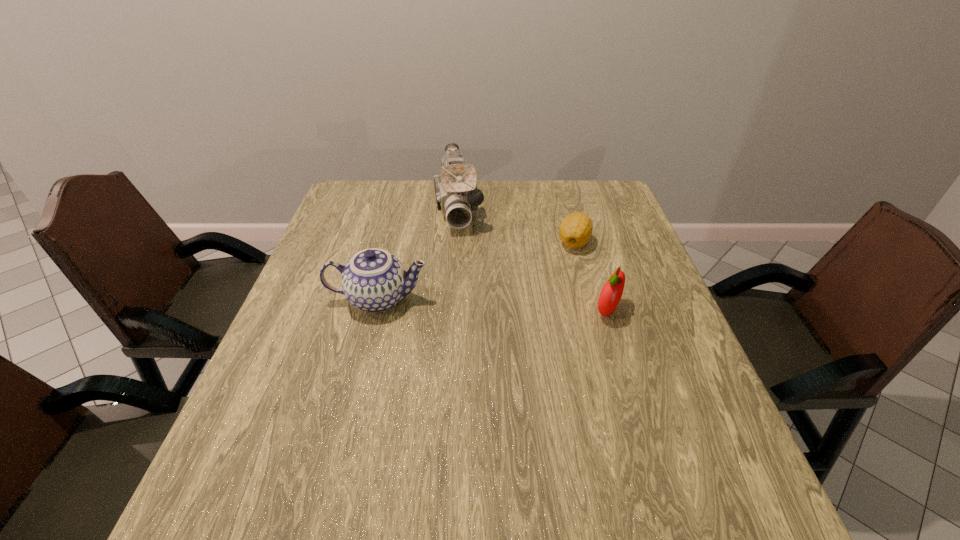
Find the location of `vacant space situated 0.400m at the stem end of the lemon`. vacant space situated 0.400m at the stem end of the lemon is located at coordinates (465, 334).

At what (x,y) coordinates should I click in order to perform the action: click on blank area located at the stem end of the lemon. Please return your answer as a coordinate pair (x, y). Looking at the image, I should click on (552, 262).

You are a GUI agent. You are given a task and a screenshot of the screen. Output one action in this format:
    pyautogui.click(x=<x>, y=<y>)
    Task: Click on the object located at the far edge
    
    Given the screenshot: What is the action you would take?
    pyautogui.click(x=456, y=192)

This screenshot has height=540, width=960. In order to click on object that is positioned at the left edge in this screenshot , I will do `click(374, 280)`.

At what (x,y) coordinates should I click in order to perform the action: click on apple that is at the right edge. Please return your answer as a coordinate pair (x, y). This screenshot has height=540, width=960. Looking at the image, I should click on (611, 293).

Where is `lemon situated at the right edge`? The width and height of the screenshot is (960, 540). lemon situated at the right edge is located at coordinates (575, 230).

The width and height of the screenshot is (960, 540). In the image, there is a desktop. What are the coordinates of `blank space at the far edge` in the screenshot? It's located at (524, 216).

At what (x,y) coordinates should I click in order to perform the action: click on free location at the near edge. Please return your answer as a coordinate pair (x, y). Image resolution: width=960 pixels, height=540 pixels. Looking at the image, I should click on (486, 418).

Locate an element on the screen. This screenshot has width=960, height=540. vacant area at the left edge of the desktop is located at coordinates (305, 281).

Image resolution: width=960 pixels, height=540 pixels. What are the coordinates of `free location at the right edge` in the screenshot? It's located at (614, 322).